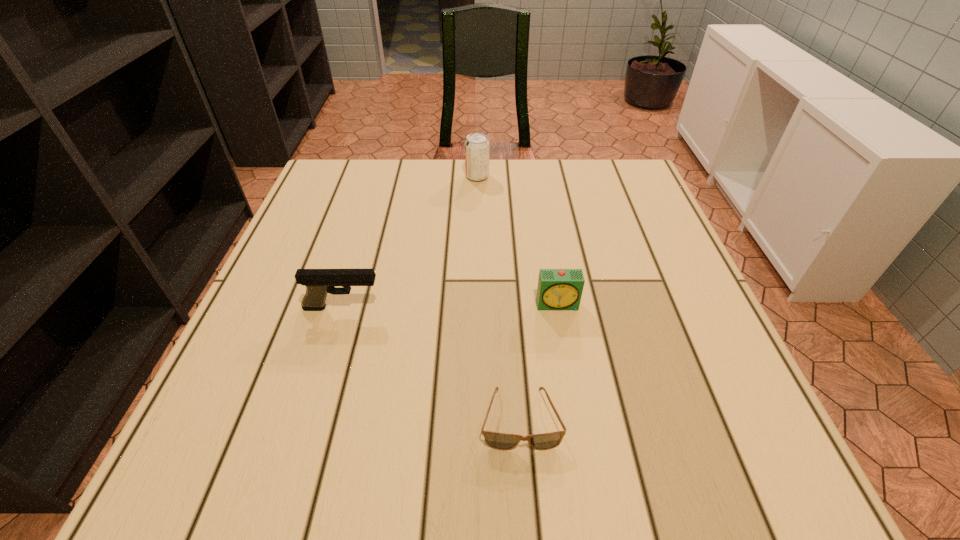
The image size is (960, 540). Identify the location of free space that satisfies the following two spatial constraints: 1. on the front-facing side of the second shortest object; 2. on the front-facing side of the pistol. (559, 308).

Where is `vacant space that satisfies the following two spatial constraints: 1. on the front side of the farthest object; 2. on the front-facing side of the leftmost object`? This screenshot has height=540, width=960. vacant space that satisfies the following two spatial constraints: 1. on the front side of the farthest object; 2. on the front-facing side of the leftmost object is located at coordinates click(476, 308).